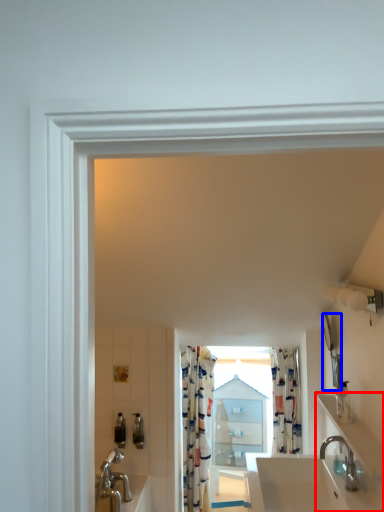
Question: Which object appears closest to the camera in this image, counter top (highlighted by a red box) or mirror (highlighted by a blue box)?

Choices:
 (A) counter top
 (B) mirror

Answer: (A)